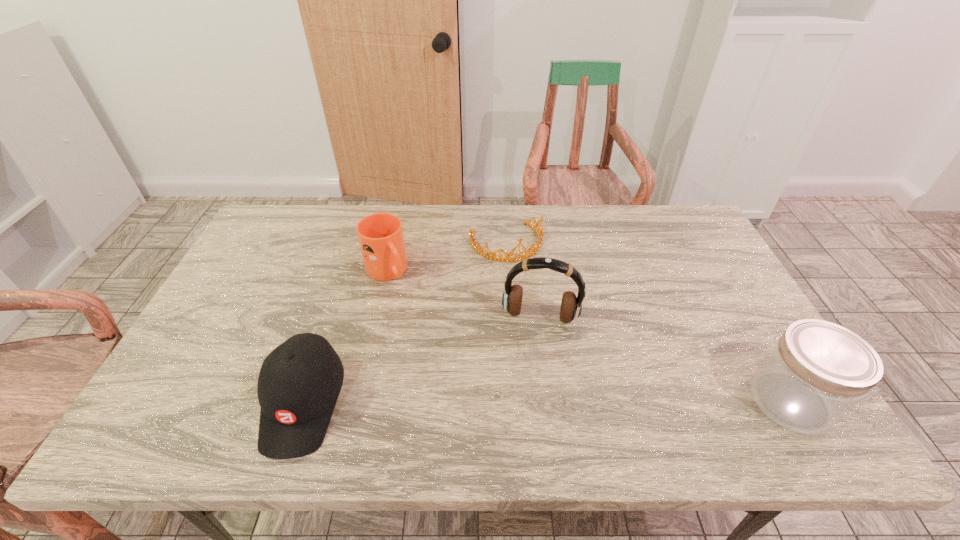
The height and width of the screenshot is (540, 960). In order to click on blank space at the far edge in this screenshot , I will do `click(551, 231)`.

Find the location of a particular element. The image size is (960, 540). blank area at the near edge is located at coordinates (553, 380).

The height and width of the screenshot is (540, 960). Find the location of `free space at the left edge of the desktop`. free space at the left edge of the desktop is located at coordinates pos(223,289).

Where is `vacant space at the right edge of the desktop`? vacant space at the right edge of the desktop is located at coordinates (701, 278).

The image size is (960, 540). In the image, there is a desktop. Identify the location of free region at the far left corner. (255, 239).

The height and width of the screenshot is (540, 960). In the image, there is a desktop. In order to click on vacant area at the near left corner in this screenshot , I will do `click(215, 377)`.

You are a GUI agent. You are given a task and a screenshot of the screen. Output one action in this format:
    pyautogui.click(x=<x>, y=<y>)
    Task: Click on the vacant space at the far right corner
    The width and height of the screenshot is (960, 540).
    Given the screenshot: What is the action you would take?
    pyautogui.click(x=690, y=224)

Where is `free location at the near right corner`? This screenshot has width=960, height=540. free location at the near right corner is located at coordinates (744, 384).

This screenshot has width=960, height=540. What are the coordinates of `vacant space that's between the third nearest object and the shortest object` in the screenshot? It's located at (523, 280).

Find the location of `free point between the rightmost object and the baseball cap`. free point between the rightmost object and the baseball cap is located at coordinates (547, 402).